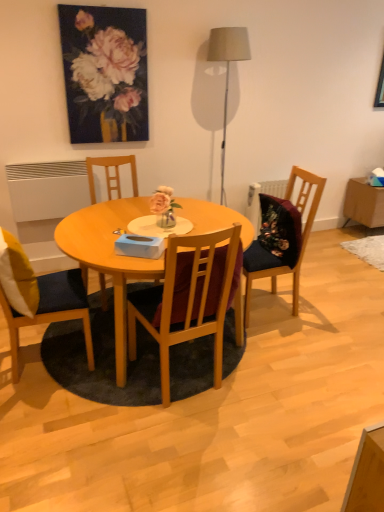
Question: From the image's perspective, would you say wooden chair at left, positioned as the 4th chair in right-to-left order, is positioned over matte gray floor lamp at upper center?

Choices:
 (A) yes
 (B) no

Answer: (B)

Question: Does wooden chair at left, the 1th chair positioned from the left, have a larger size compared to matte gray floor lamp at upper center?

Choices:
 (A) yes
 (B) no

Answer: (A)

Question: Is wooden chair at left, the 1th chair positioned from the left, positioned behind matte gray floor lamp at upper center?

Choices:
 (A) no
 (B) yes

Answer: (A)

Question: Is wooden chair at left, positioned as the 4th chair in right-to-left order, to the right of matte gray floor lamp at upper center from the viewer's perspective?

Choices:
 (A) yes
 (B) no

Answer: (B)

Question: Is wooden chair at left, the 1th chair positioned from the left, surrounding matte gray floor lamp at upper center?

Choices:
 (A) yes
 (B) no

Answer: (B)

Question: Is oil painting at upper center to the left or to the right of wooden chair at left, positioned as the 4th chair in right-to-left order, in the image?

Choices:
 (A) right
 (B) left

Answer: (A)

Question: Relative to wooden chair at left, the 1th chair positioned from the left, is oil painting at upper center in front or behind?

Choices:
 (A) front
 (B) behind

Answer: (B)

Question: Is oil painting at upper center taller or shorter than wooden chair at left, the 1th chair positioned from the left?

Choices:
 (A) tall
 (B) short

Answer: (B)

Question: From the image's perspective, is oil painting at upper center located above or below wooden chair at left, the 1th chair positioned from the left?

Choices:
 (A) above
 (B) below

Answer: (A)

Question: From the image's perspective, is wooden chair at center, which appears as the third chair when viewed from the right, above or below wooden chair at center, the 2th chair when ordered from right to left?

Choices:
 (A) above
 (B) below

Answer: (A)

Question: Does point (94, 160) appear closer or farther from the camera than point (157, 289)?

Choices:
 (A) farther
 (B) closer

Answer: (A)

Question: In the image, is wooden chair at center, the second chair viewed from the left, on the left side or the right side of wooden chair at center, which appears as the third chair when viewed from the left?

Choices:
 (A) left
 (B) right

Answer: (A)

Question: Considering the positions of wooden chair at center, which appears as the third chair when viewed from the right, and wooden chair at center, the 2th chair when ordered from right to left, in the image, is wooden chair at center, which appears as the third chair when viewed from the right, wider or thinner than wooden chair at center, the 2th chair when ordered from right to left,?

Choices:
 (A) wide
 (B) thin

Answer: (A)

Question: In terms of height, does dark blue fabric chair at center, acting as the first chair starting from the right, look taller or shorter compared to yellow fabric pillow at left?

Choices:
 (A) tall
 (B) short

Answer: (A)

Question: Is dark blue fabric chair at center, acting as the first chair starting from the right, wider or thinner than yellow fabric pillow at left?

Choices:
 (A) wide
 (B) thin

Answer: (A)